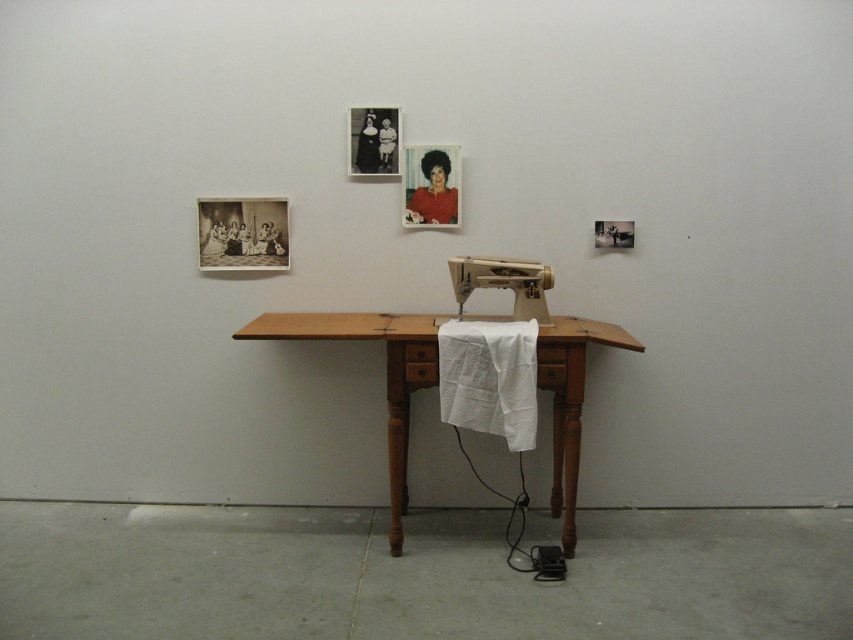
Question: Which is nearer to the white plastic sewing machine at center?

Choices:
 (A) white cotton cloth at center
 (B) wooden sewing machine at center
 (C) black matte photo frame at upper center
 (D) black paper picture frame at upper left

Answer: (A)

Question: Does white cotton cloth at center have a greater width compared to black paper picture frame at upper left?

Choices:
 (A) yes
 (B) no

Answer: (B)

Question: Can you confirm if wooden sewing machine at center is positioned to the right of white plastic sewing machine at center?

Choices:
 (A) yes
 (B) no

Answer: (B)

Question: Which of the following is the closest to the observer?

Choices:
 (A) (412, 224)
 (B) (215, 220)
 (C) (381, 168)
 (D) (547, 340)

Answer: (D)

Question: Is wooden sewing machine at center to the left of black matte photo frame at upper center from the viewer's perspective?

Choices:
 (A) no
 (B) yes

Answer: (A)

Question: Which object is positioned farthest from the white cotton cloth at center?

Choices:
 (A) matte plastic picture frame at center
 (B) wooden sewing machine at center

Answer: (A)